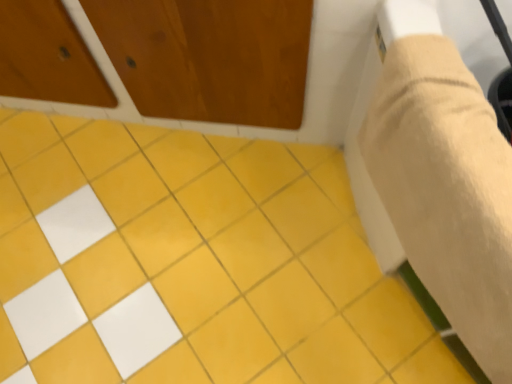
What is the approximate width of yellow matte tile at center?

It is 5.56 feet.

In order to face yellow matte tile at center, should I rotate leftwards or rightwards?

A 7.232 degree turn to the left will do.

Measure the distance between point [219,315] and camera.

A: They are 4.13 feet apart.

Image resolution: width=512 pixels, height=384 pixels. What do you see at coordinates (192, 263) in the screenshot? I see `yellow matte tile at center` at bounding box center [192, 263].

Where is `yellow matte tile at center`? yellow matte tile at center is located at coordinates (192, 263).

Measure the distance between point (473, 218) and camera.

The depth of point (473, 218) is 27.83 inches.

What do you see at coordinates (447, 189) in the screenshot? I see `beige fabric plaster bandage at right` at bounding box center [447, 189].

Locate an element on the screen. This screenshot has height=384, width=512. beige fabric plaster bandage at right is located at coordinates (447, 189).

You are a GUI agent. You are given a task and a screenshot of the screen. Output one action in this format:
    pyautogui.click(x=<x>, y=<y>)
    Task: Click on the yellow matte tile at center
    
    Given the screenshot: What is the action you would take?
    pyautogui.click(x=192, y=263)

Can you confirm if yellow matte tile at center is positioned to the right of beige fabric plaster bandage at right?

In fact, yellow matte tile at center is to the left of beige fabric plaster bandage at right.

Which object is closer to the camera taking this photo, yellow matte tile at center or beige fabric plaster bandage at right?

beige fabric plaster bandage at right is more forward.

Considering the points (359, 314) and (471, 202), which point is behind, point (359, 314) or point (471, 202)?

The point (359, 314) is more distant.

From the image's perspective, is yellow matte tile at center located beneath beige fabric plaster bandage at right?

Indeed, from the image's perspective, yellow matte tile at center is shown beneath beige fabric plaster bandage at right.

From a real-world perspective, is yellow matte tile at center physically located above or below beige fabric plaster bandage at right?

From a real-world perspective, yellow matte tile at center is physically below beige fabric plaster bandage at right.

Can you confirm if yellow matte tile at center is wider than beige fabric plaster bandage at right?

Yes.

Between yellow matte tile at center and beige fabric plaster bandage at right, which one has more height?

beige fabric plaster bandage at right.

Looking at the image, does yellow matte tile at center seem bigger or smaller compared to beige fabric plaster bandage at right?

yellow matte tile at center is smaller than beige fabric plaster bandage at right.

Would you say yellow matte tile at center is inside or outside beige fabric plaster bandage at right?

yellow matte tile at center is located beyond the bounds of beige fabric plaster bandage at right.

Is yellow matte tile at center directly adjacent to beige fabric plaster bandage at right?

No, yellow matte tile at center is not with beige fabric plaster bandage at right.

Is yellow matte tile at center turned away from beige fabric plaster bandage at right?

yellow matte tile at center is not turned away from beige fabric plaster bandage at right.

In the scene shown: What's the angular difference between yellow matte tile at center and beige fabric plaster bandage at right's facing directions?

The angular difference between yellow matte tile at center and beige fabric plaster bandage at right is 32.7 degrees.

Measure the distance between yellow matte tile at center and beige fabric plaster bandage at right.

yellow matte tile at center is 22.78 inches away from beige fabric plaster bandage at right.

You are a GUI agent. You are given a task and a screenshot of the screen. Output one action in this format:
    pyautogui.click(x=<x>, y=<y>)
    Task: Click on the ceramic tile that is under the beige fabric plaster bandage at right (from a real-world perspective)
    The height and width of the screenshot is (384, 512).
    Given the screenshot: What is the action you would take?
    pyautogui.click(x=192, y=263)

Is beige fabric plaster bandage at right to the right of yellow matte tile at center from the viewer's perspective?

Yes, beige fabric plaster bandage at right is to the right of yellow matte tile at center.

Consider the image. Is the position of beige fabric plaster bandage at right less distant than that of yellow matte tile at center?

Yes, it is in front of yellow matte tile at center.

Which is nearer, (441,38) or (288,352)?

Point (441,38)

From the image's perspective, is beige fabric plaster bandage at right located above or below yellow matte tile at center?

Clearly, from the image's perspective, beige fabric plaster bandage at right is above yellow matte tile at center.

In the scene shown: From a real-world perspective, is beige fabric plaster bandage at right located higher than yellow matte tile at center?

Yes.

Is beige fabric plaster bandage at right wider or thinner than yellow matte tile at center?

beige fabric plaster bandage at right is thinner than yellow matte tile at center.

Can you confirm if beige fabric plaster bandage at right is taller than yellow matte tile at center?

Yes, beige fabric plaster bandage at right is taller than yellow matte tile at center.

Which of these two, beige fabric plaster bandage at right or yellow matte tile at center, is smaller?

With smaller size is yellow matte tile at center.

Is beige fabric plaster bandage at right spatially inside yellow matte tile at center, or outside of it?

beige fabric plaster bandage at right is located beyond the bounds of yellow matte tile at center.

Does beige fabric plaster bandage at right touch yellow matte tile at center?

beige fabric plaster bandage at right is not next to yellow matte tile at center, and they're not touching.

Is beige fabric plaster bandage at right aimed at yellow matte tile at center?

No, beige fabric plaster bandage at right is not aimed at yellow matte tile at center.

Can you tell me how much beige fabric plaster bandage at right and yellow matte tile at center differ in facing direction?

There is a 32.7-degree angle between the facing directions of beige fabric plaster bandage at right and yellow matte tile at center.

Based on the photo, how far apart are beige fabric plaster bandage at right and yellow matte tile at center?

57.86 centimeters.

Where is `ceramic tile located below the beige fabric plaster bandage at right (from the image's perspective)`? Image resolution: width=512 pixels, height=384 pixels. ceramic tile located below the beige fabric plaster bandage at right (from the image's perspective) is located at coordinates (192, 263).

Where is `plaster bandage above the yellow matte tile at center (from a real-world perspective)`? The image size is (512, 384). plaster bandage above the yellow matte tile at center (from a real-world perspective) is located at coordinates (447, 189).

Where is `plaster bandage on the right of the yellow matte tile at center`? Image resolution: width=512 pixels, height=384 pixels. plaster bandage on the right of the yellow matte tile at center is located at coordinates (447, 189).